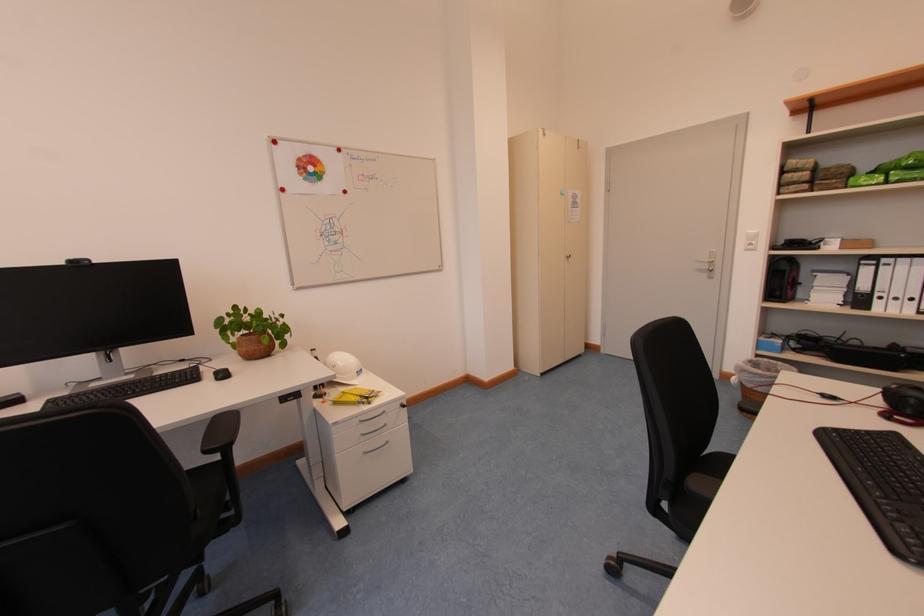
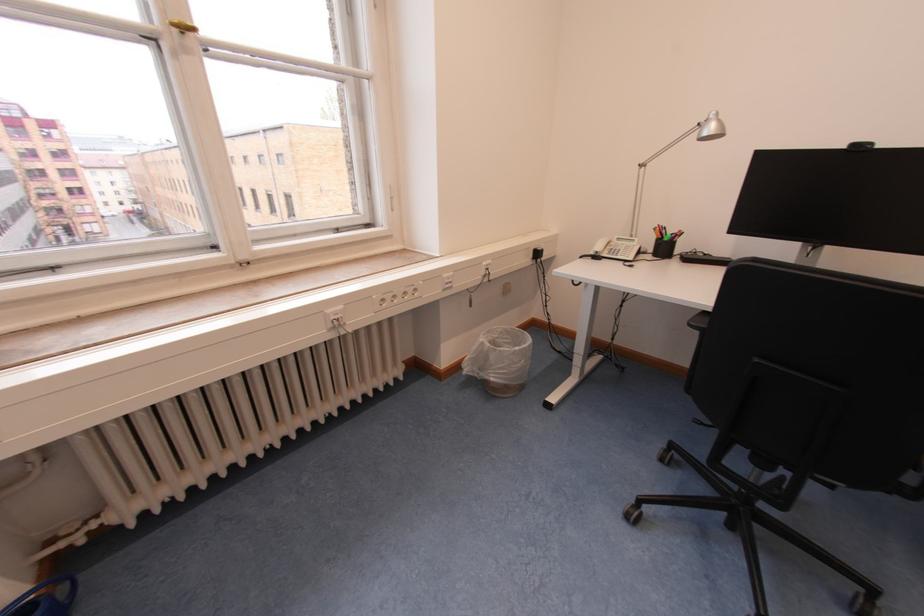
Based on the photo, the first image is from the beginning of the video and the second image is from the end. How did the camera likely rotate when shooting the video?

The camera rotated toward left-down.